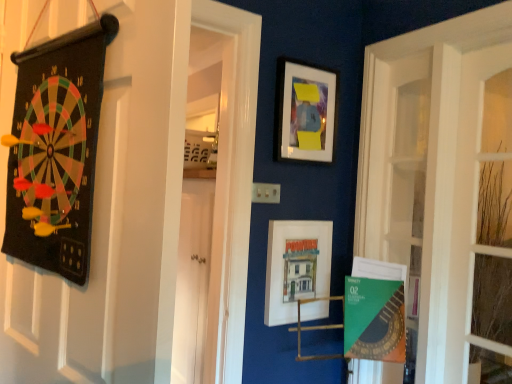
Question: In which direction should I rotate to look at matte white picture frame at upper center, the 1th picture frame positioned from the top?

Choices:
 (A) right
 (B) left

Answer: (A)

Question: Which direction should I rotate to look at matte white picture frame at center, arranged as the first picture frame when ordered from the bottom?

Choices:
 (A) right
 (B) left

Answer: (A)

Question: Is matte white picture frame at upper center, marked as the second picture frame in a bottom-to-top arrangement, positioned far away from matte white picture frame at center, arranged as the first picture frame when ordered from the bottom?

Choices:
 (A) yes
 (B) no

Answer: (B)

Question: Does matte white picture frame at upper center, the 1th picture frame positioned from the top, contain matte white picture frame at center, arranged as the 2th picture frame when viewed from the top?

Choices:
 (A) yes
 (B) no

Answer: (B)

Question: Is matte white picture frame at upper center, the 1th picture frame positioned from the top, thinner than matte white picture frame at center, arranged as the 2th picture frame when viewed from the top?

Choices:
 (A) yes
 (B) no

Answer: (A)

Question: From a real-world perspective, is matte white picture frame at upper center, marked as the second picture frame in a bottom-to-top arrangement, on matte white picture frame at center, arranged as the first picture frame when ordered from the bottom?

Choices:
 (A) no
 (B) yes

Answer: (B)

Question: Is matte white picture frame at upper center, the 1th picture frame positioned from the top, at the right side of matte white picture frame at center, arranged as the 2th picture frame when viewed from the top?

Choices:
 (A) no
 (B) yes

Answer: (B)

Question: Is matte white picture frame at center, arranged as the first picture frame when ordered from the bottom, at the back of matte white picture frame at upper center, the 1th picture frame positioned from the top?

Choices:
 (A) no
 (B) yes

Answer: (A)

Question: Can you confirm if green paper at lower right is taller than matte white picture frame at center, arranged as the 2th picture frame when viewed from the top?

Choices:
 (A) yes
 (B) no

Answer: (B)

Question: Considering the relative sizes of green paper at lower right and matte white picture frame at center, arranged as the first picture frame when ordered from the bottom, in the image provided, is green paper at lower right wider than matte white picture frame at center, arranged as the first picture frame when ordered from the bottom,?

Choices:
 (A) yes
 (B) no

Answer: (A)

Question: From the image's perspective, is green paper at lower right located beneath matte white picture frame at center, arranged as the 2th picture frame when viewed from the top?

Choices:
 (A) no
 (B) yes

Answer: (B)

Question: Could you tell me if green paper at lower right is facing matte white picture frame at center, arranged as the 2th picture frame when viewed from the top?

Choices:
 (A) yes
 (B) no

Answer: (B)

Question: Does green paper at lower right touch matte white picture frame at center, arranged as the 2th picture frame when viewed from the top?

Choices:
 (A) yes
 (B) no

Answer: (B)

Question: Is green paper at lower right smaller than matte white picture frame at center, arranged as the 2th picture frame when viewed from the top?

Choices:
 (A) no
 (B) yes

Answer: (B)

Question: Considering the relative positions of green paper at lower right and black felt dartboard at left in the image provided, is green paper at lower right to the right of black felt dartboard at left from the viewer's perspective?

Choices:
 (A) no
 (B) yes

Answer: (B)